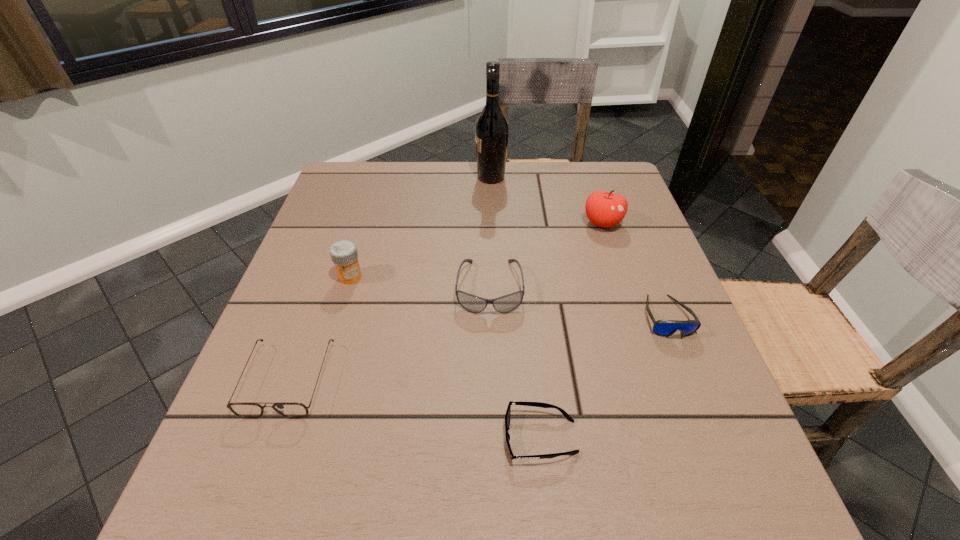
Find the location of a particular element. sunglasses that is at the left edge is located at coordinates (246, 410).

Identify the location of apple that is at the right edge. The width and height of the screenshot is (960, 540). (604, 209).

You are a GUI agent. You are given a task and a screenshot of the screen. Output one action in this format:
    pyautogui.click(x=<x>, y=<y>)
    Task: Click on the sunglasses that is positioned at the right edge
    
    Given the screenshot: What is the action you would take?
    pyautogui.click(x=665, y=328)

Identify the location of vacant space at the far edge. The width and height of the screenshot is (960, 540). (435, 172).

What are the coordinates of `vacant region at the near edge of the desktop` in the screenshot? It's located at (377, 498).

I want to click on free space at the left edge of the desktop, so click(x=328, y=336).

In the image, there is a desktop. At what (x,y) coordinates should I click in order to perform the action: click on vacant space at the right edge. Please return your answer as a coordinate pair (x, y). Looking at the image, I should click on (646, 221).

In the image, there is a desktop. At what (x,y) coordinates should I click in order to perform the action: click on vacant space at the far left corner. Please return your answer as a coordinate pair (x, y). The image size is (960, 540). Looking at the image, I should click on (358, 162).

Find the location of a particular element. This screenshot has height=540, width=960. vacant space at the near left corner of the desktop is located at coordinates (227, 504).

Locate an element on the screen. This screenshot has width=960, height=540. vacant space at the far right corner of the desktop is located at coordinates (625, 179).